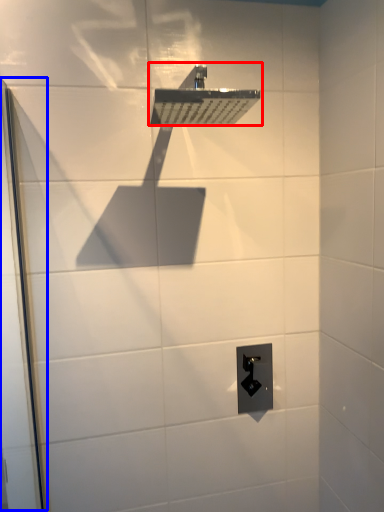
Question: Which of the following is the closest to the observer, shower (highlighted by a red box) or screen door (highlighted by a blue box)?

Choices:
 (A) shower
 (B) screen door

Answer: (B)